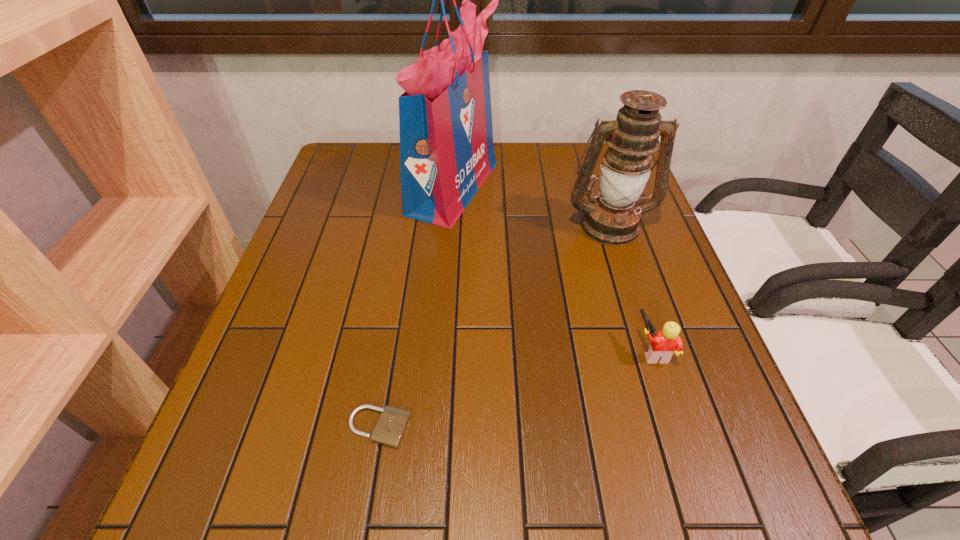
The height and width of the screenshot is (540, 960). In order to click on empty location between the nearest object and the lantern in this screenshot , I will do `click(494, 326)`.

At what (x,y) coordinates should I click in order to perform the action: click on object that is the closest to the lantern. Please return your answer as a coordinate pair (x, y). This screenshot has height=540, width=960. Looking at the image, I should click on (445, 119).

This screenshot has height=540, width=960. I want to click on object that is the closest one to the tallest object, so click(612, 219).

You are a GUI agent. You are given a task and a screenshot of the screen. Output one action in this format:
    pyautogui.click(x=<x>, y=<y>)
    Task: Click on the vacant space that satisfies the following two spatial constraints: 1. on the front-facing side of the third shortest object; 2. on the left side of the grocery bag
    The height and width of the screenshot is (540, 960).
    Given the screenshot: What is the action you would take?
    pyautogui.click(x=450, y=225)

At what (x,y) coordinates should I click in order to perform the action: click on free location that satisfies the following two spatial constraints: 1. on the front-facing side of the tallest object; 2. on the right side of the third shortest object. Please return your answer as a coordinate pair (x, y). Looking at the image, I should click on (450, 225).

What are the coordinates of `vacant region that satisfies the following two spatial constraints: 1. on the front-facing side of the grocery bag; 2. on the left side of the second tallest object` in the screenshot? It's located at (450, 225).

I want to click on free location that satisfies the following two spatial constraints: 1. on the front-facing side of the grocery bag; 2. on the front side of the nearest object, so click(x=436, y=428).

This screenshot has width=960, height=540. What are the coordinates of `vacant area that satisfies the following two spatial constraints: 1. on the front-facing side of the lantern; 2. on the left side of the tallest object` in the screenshot? It's located at (450, 225).

This screenshot has width=960, height=540. Find the location of `vacant space that satisfies the following two spatial constraints: 1. on the front-facing side of the tallest object; 2. on the front side of the padlock`. vacant space that satisfies the following two spatial constraints: 1. on the front-facing side of the tallest object; 2. on the front side of the padlock is located at coordinates (436, 428).

Locate an element on the screen. The height and width of the screenshot is (540, 960). free region that satisfies the following two spatial constraints: 1. on the back side of the third shortest object; 2. on the front-facing side of the tallest object is located at coordinates (597, 187).